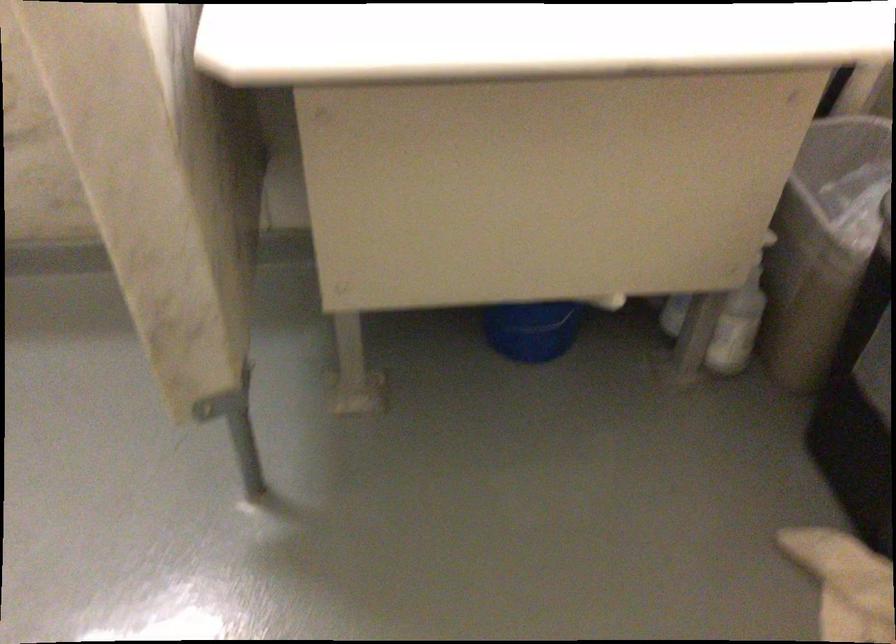
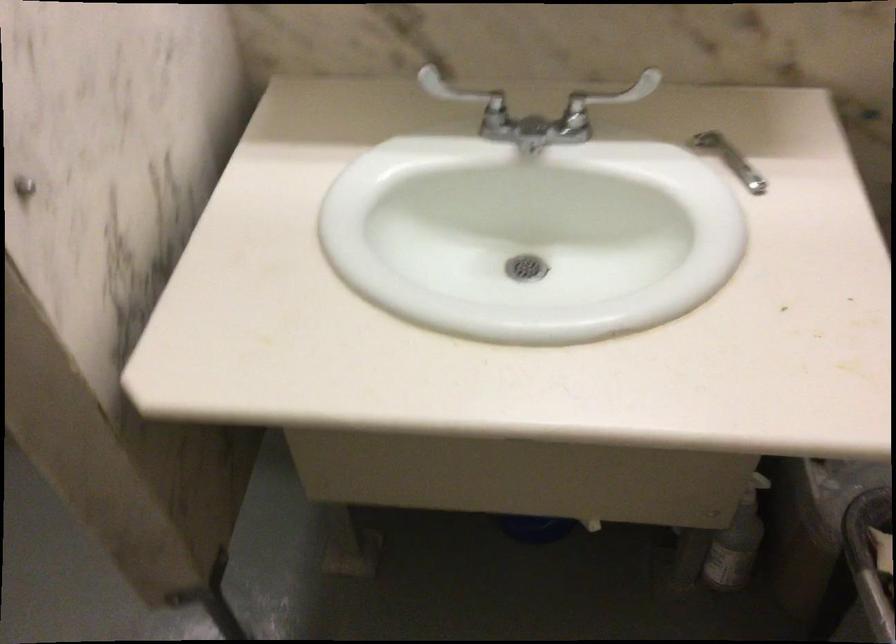
Where in the second image is the point corresponding to [742,308] from the first image?

(737, 542)